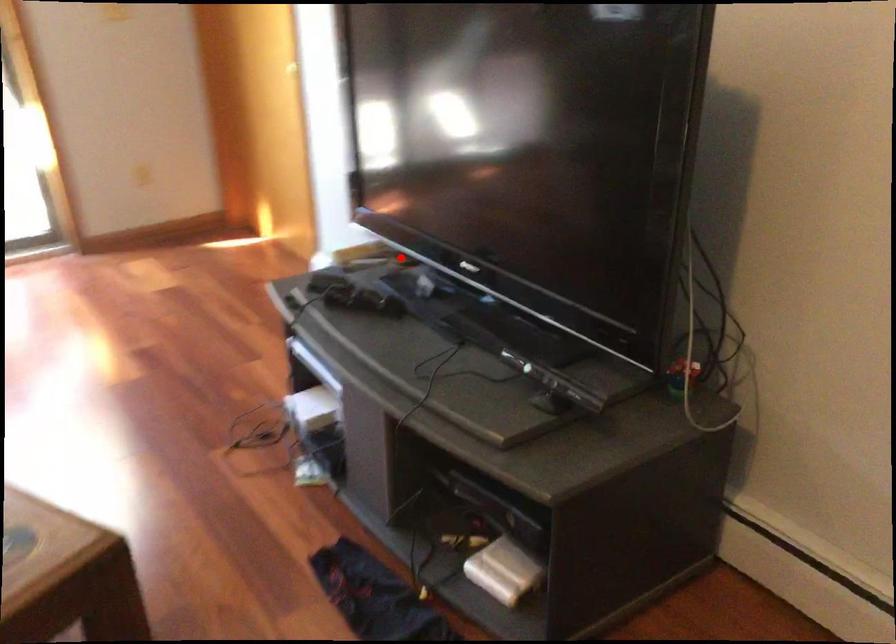
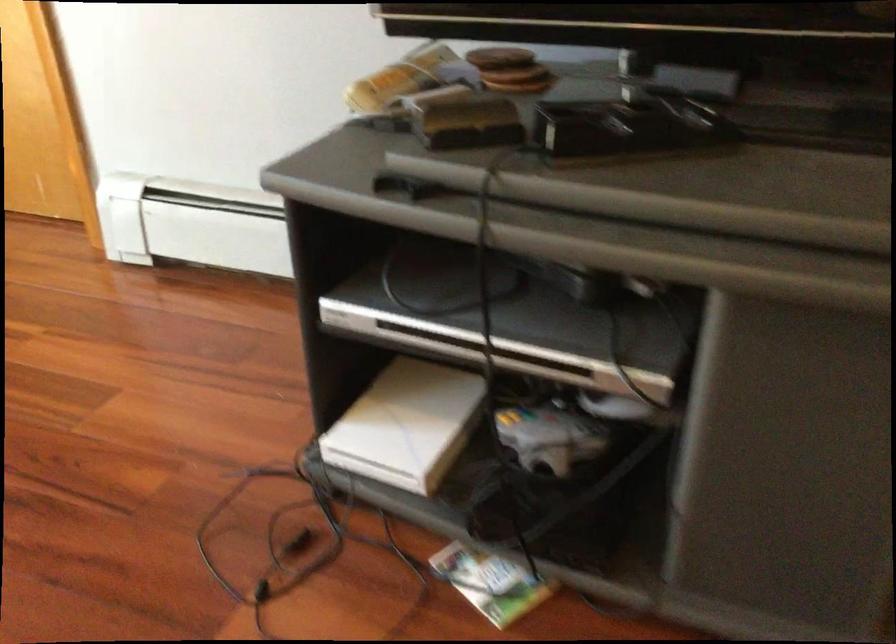
Question: I am providing you with two images of the same scene from different viewpoints. In image1, a red point is highlighted. Considering the same 3D point in image2, which of the following is correct?

Choices:
 (A) It is closer
 (B) It is farther

Answer: (A)